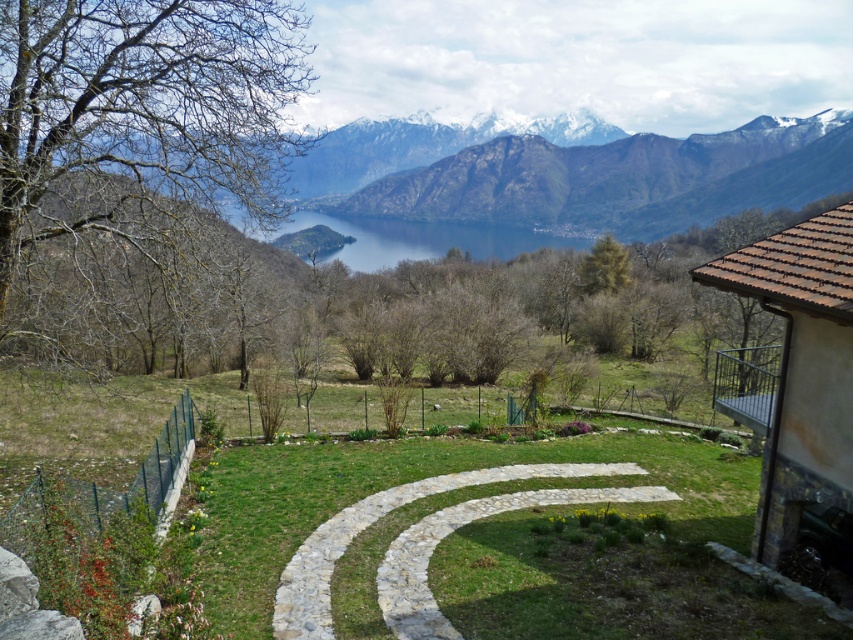
Question: Does natural stone path at center have a lesser width compared to greenish-blue water at center?

Choices:
 (A) yes
 (B) no

Answer: (A)

Question: Is natural stone path at center bigger than greenish-blue water at center?

Choices:
 (A) yes
 (B) no

Answer: (B)

Question: Can you confirm if snowy rock mountain at upper center is thinner than natural stone path at center?

Choices:
 (A) yes
 (B) no

Answer: (B)

Question: Which point is farther to the camera?

Choices:
 (A) (299, 579)
 (B) (392, 237)

Answer: (B)

Question: Which of the following is the closest to the observer?

Choices:
 (A) (430, 209)
 (B) (338, 256)
 (C) (496, 476)

Answer: (C)

Question: Based on their relative distances, which object is farther from the natural stone path at center?

Choices:
 (A) snowy rock mountain at upper center
 (B) greenish-blue water at center

Answer: (A)